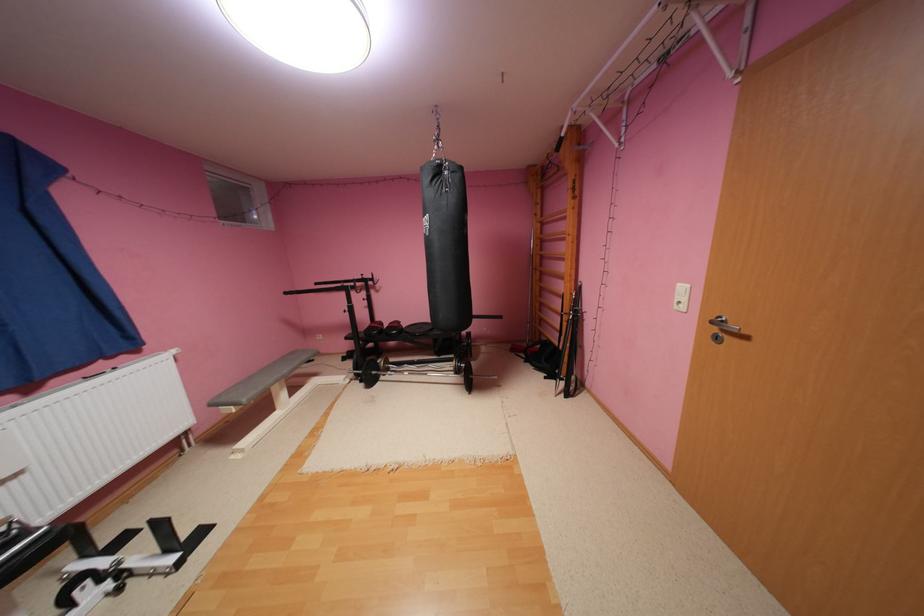
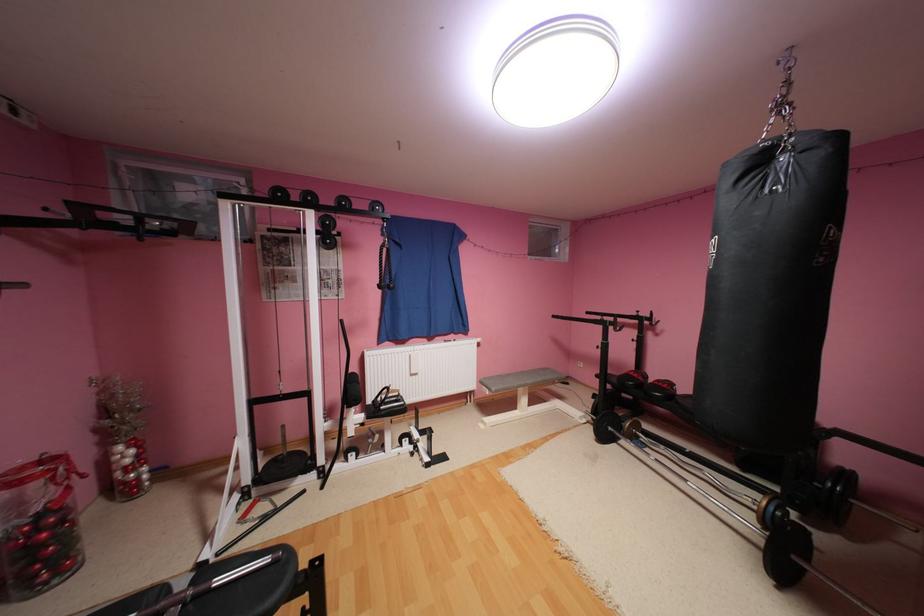
Find the pixel in the second image that matches [371,334] in the first image.

(624, 379)